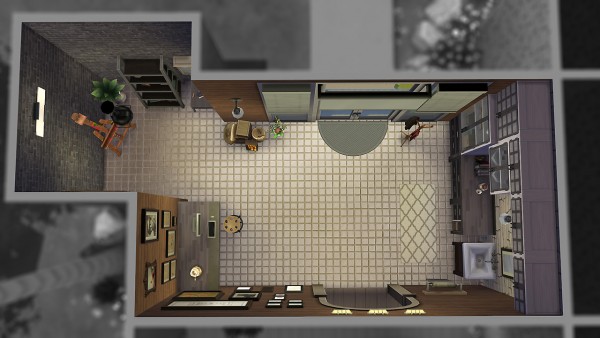
The image size is (600, 338). I want to click on easel, so click(104, 144).